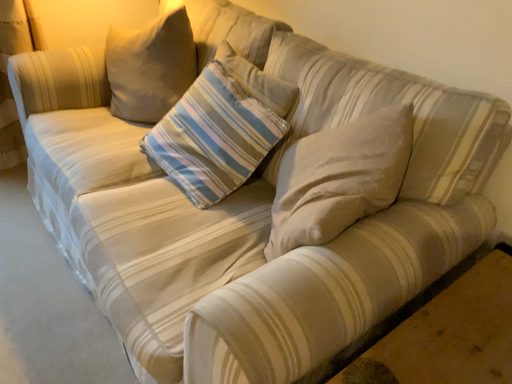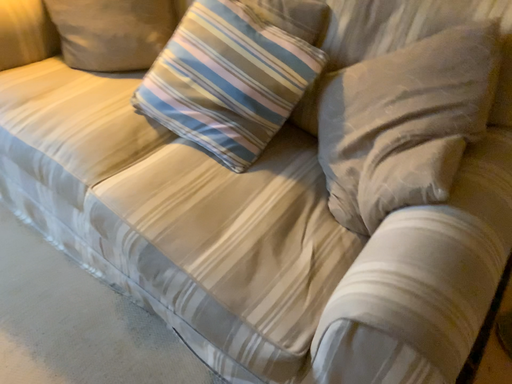
Question: How did the camera likely rotate when shooting the video?

Choices:
 (A) rotated right
 (B) rotated left

Answer: (A)